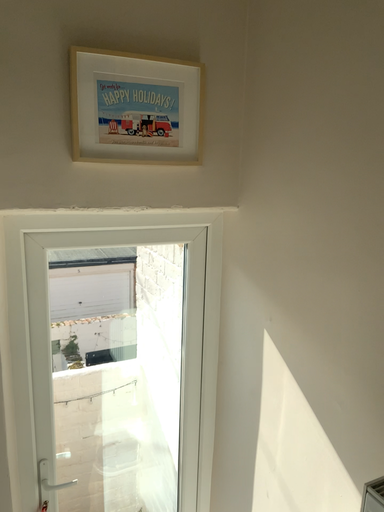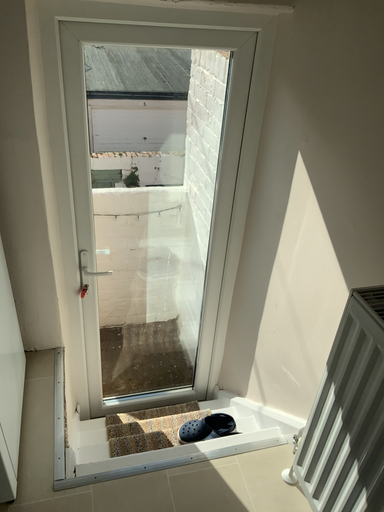
Question: How did the camera likely rotate when shooting the video?

Choices:
 (A) rotated downward
 (B) rotated upward

Answer: (A)